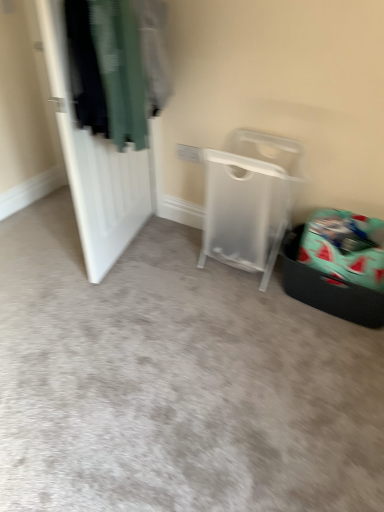
Question: Is teal fabric laundry basket at lower right in front of or behind white matte door at left in the image?

Choices:
 (A) front
 (B) behind

Answer: (B)

Question: From a real-world perspective, is teal fabric laundry basket at lower right physically located above or below white matte door at left?

Choices:
 (A) above
 (B) below

Answer: (B)

Question: Estimate the real-world distances between objects in this image. Which object is closer to the white matte door at left?

Choices:
 (A) dark green fabric at left
 (B) teal fabric laundry basket at lower right
 (C) transparent plastic trash bin at right
 (D) transparent plastic laundry basket at center

Answer: (A)

Question: Estimate the real-world distances between objects in this image. Which object is closer to the dark green fabric at left?

Choices:
 (A) transparent plastic laundry basket at center
 (B) transparent plastic trash bin at right
 (C) teal fabric laundry basket at lower right
 (D) white matte door at left

Answer: (D)